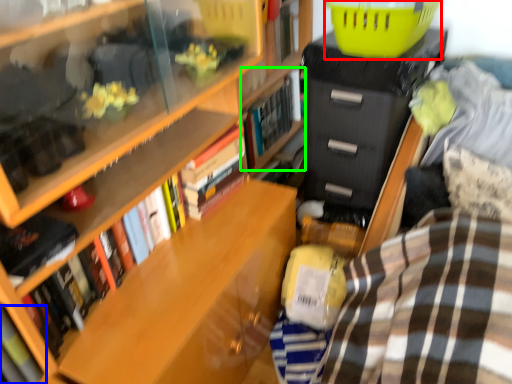
Question: Considering the real-world distances, which object is farthest from basket (highlighted by a red box)? book (highlighted by a blue box) or book (highlighted by a green box)?

Choices:
 (A) book
 (B) book

Answer: (A)